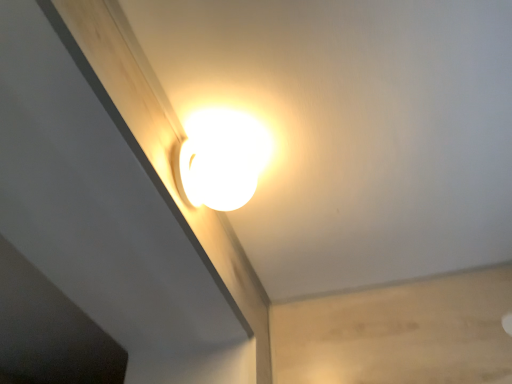
I want to click on white glossy bulb at upper center, so click(222, 159).

The width and height of the screenshot is (512, 384). Describe the element at coordinates (222, 159) in the screenshot. I see `white glossy bulb at upper center` at that location.

I want to click on white glossy bulb at upper center, so click(222, 159).